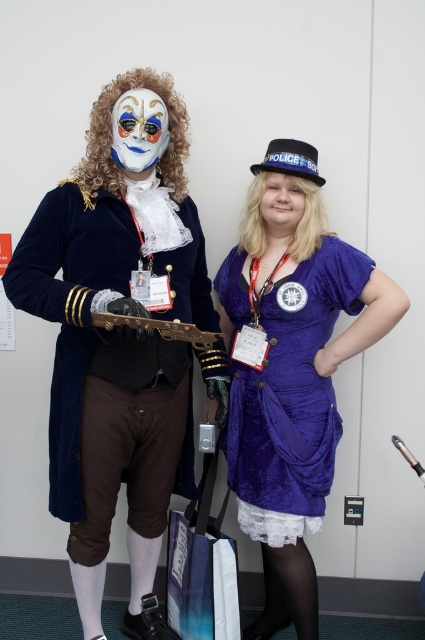
In the scene shown: Does velvet purple dress at center have a lesser width compared to velvet blue coat at center?

Incorrect, velvet purple dress at center's width is not less than velvet blue coat at center's.

Which of these two, velvet purple dress at center or velvet blue coat at center, stands taller?

With more height is velvet purple dress at center.

What do you see at coordinates (291, 369) in the screenshot?
I see `velvet purple dress at center` at bounding box center [291, 369].

I want to click on velvet purple dress at center, so click(291, 369).